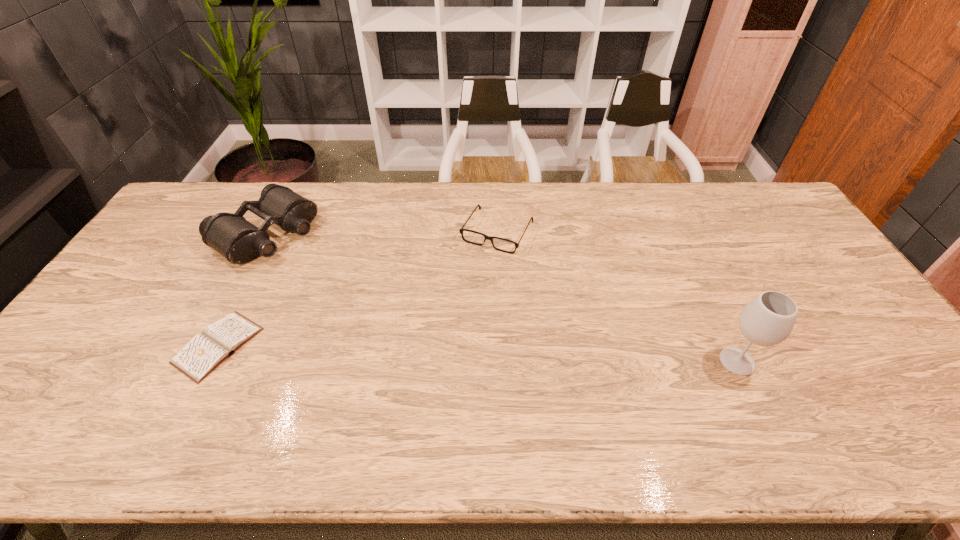
I want to click on free location located on the front-facing side of the second object from right to left, so 439,335.

Where is `free space located through the eyepieces of the second tallest object`? This screenshot has height=540, width=960. free space located through the eyepieces of the second tallest object is located at coordinates (376, 308).

Identify the location of free spot located through the eyepieces of the second tallest object. (369, 303).

At what (x,y) coordinates should I click in order to perform the action: click on free region located 0.380m through the eyepieces of the second tallest object. Please return your answer as a coordinate pair (x, y). The height and width of the screenshot is (540, 960). Looking at the image, I should click on (381, 312).

You are a GUI agent. You are given a task and a screenshot of the screen. Output one action in this format:
    pyautogui.click(x=<x>, y=<y>)
    Task: Click on the spectacles at the far edge
    This screenshot has width=960, height=540.
    Given the screenshot: What is the action you would take?
    pyautogui.click(x=461, y=230)

Find the location of `binoculars that is at the far edge`. binoculars that is at the far edge is located at coordinates [x=239, y=241].

Where is `diary that is at the near edge`? diary that is at the near edge is located at coordinates (203, 353).

The width and height of the screenshot is (960, 540). I want to click on wineglass present at the near edge, so click(x=768, y=319).

Identify the location of free space at the far edge of the desktop. (239, 189).

I want to click on vacant space at the near edge, so click(780, 377).